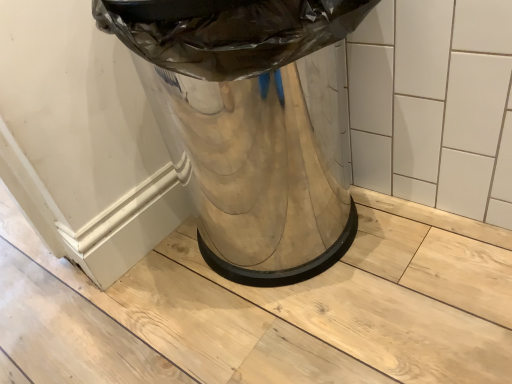
The width and height of the screenshot is (512, 384). What do you see at coordinates (435, 104) in the screenshot?
I see `white glossy tile at upper center` at bounding box center [435, 104].

At what (x,y) coordinates should I click in order to perform the action: click on white glossy tile at upper center. Please return your answer as a coordinate pair (x, y). Image resolution: width=512 pixels, height=384 pixels. Looking at the image, I should click on (435, 104).

Describe the element at coordinates (245, 126) in the screenshot. Image resolution: width=512 pixels, height=384 pixels. I see `shiny metallic trash can at center` at that location.

The image size is (512, 384). In order to click on shiny metallic trash can at center in this screenshot , I will do 245,126.

Image resolution: width=512 pixels, height=384 pixels. What are the coordinates of `white glossy tile at upper center` in the screenshot? It's located at (435, 104).

Does shiny metallic trash can at center appear on the left side of white glossy tile at upper center?

Indeed, shiny metallic trash can at center is positioned on the left side of white glossy tile at upper center.

Considering their positions, is shiny metallic trash can at center located in front of or behind white glossy tile at upper center?

shiny metallic trash can at center is positioned closer to the viewer than white glossy tile at upper center.

Is point (287, 14) positioned behind point (487, 66)?

No.

From the image's perspective, is shiny metallic trash can at center positioned above or below white glossy tile at upper center?

Answer: Based on their image positions, shiny metallic trash can at center is located beneath white glossy tile at upper center.

From a real-world perspective, is shiny metallic trash can at center beneath white glossy tile at upper center?

No, from a real-world perspective, shiny metallic trash can at center is not beneath white glossy tile at upper center.

Between shiny metallic trash can at center and white glossy tile at upper center, which one has larger width?

shiny metallic trash can at center.

Is shiny metallic trash can at center taller than white glossy tile at upper center?

Indeed, shiny metallic trash can at center has a greater height compared to white glossy tile at upper center.

Considering the sizes of shiny metallic trash can at center and white glossy tile at upper center in the image, is shiny metallic trash can at center bigger or smaller than white glossy tile at upper center?

shiny metallic trash can at center is bigger than white glossy tile at upper center.

Would you say white glossy tile at upper center is part of shiny metallic trash can at center's contents?

No, white glossy tile at upper center is located outside of shiny metallic trash can at center.

Are shiny metallic trash can at center and white glossy tile at upper center located far from each other?

shiny metallic trash can at center is near white glossy tile at upper center, not far away.

Does shiny metallic trash can at center turn towards white glossy tile at upper center?

No, shiny metallic trash can at center does not turn towards white glossy tile at upper center.

What's the angular difference between shiny metallic trash can at center and white glossy tile at upper center's facing directions?

89.5 degrees.

How distant is shiny metallic trash can at center from white glossy tile at upper center?

shiny metallic trash can at center and white glossy tile at upper center are 9.89 inches apart.

Find the location of a particular element. The image size is (512, 384). tile located on the right of shiny metallic trash can at center is located at coordinates (435, 104).

Between white glossy tile at upper center and shiny metallic trash can at center, which one appears on the left side from the viewer's perspective?

shiny metallic trash can at center is more to the left.

Is the position of white glossy tile at upper center more distant than that of shiny metallic trash can at center?

Yes, it is behind shiny metallic trash can at center.

Is point (386, 63) positioned in front of point (228, 206)?

Yes, it is in front of point (228, 206).

From the image's perspective, is white glossy tile at upper center over shiny metallic trash can at center?

Yes, from the image's perspective, white glossy tile at upper center is over shiny metallic trash can at center.

From a real-world perspective, is white glossy tile at upper center located beneath shiny metallic trash can at center?

Correct, in the physical world, white glossy tile at upper center is lower than shiny metallic trash can at center.

Considering the sizes of white glossy tile at upper center and shiny metallic trash can at center in the image, is white glossy tile at upper center wider or thinner than shiny metallic trash can at center?

white glossy tile at upper center is thinner than shiny metallic trash can at center.

Does white glossy tile at upper center have a lesser height compared to shiny metallic trash can at center?

Correct, white glossy tile at upper center is not as tall as shiny metallic trash can at center.

Considering the sizes of white glossy tile at upper center and shiny metallic trash can at center in the image, is white glossy tile at upper center bigger or smaller than shiny metallic trash can at center?

Clearly, white glossy tile at upper center is smaller in size than shiny metallic trash can at center.

Choose the correct answer: Is white glossy tile at upper center inside shiny metallic trash can at center or outside it?

white glossy tile at upper center is outside shiny metallic trash can at center.

Is there a large distance between white glossy tile at upper center and shiny metallic trash can at center?

No, white glossy tile at upper center is in close proximity to shiny metallic trash can at center.

From the picture: Could you tell me if white glossy tile at upper center is facing shiny metallic trash can at center?

Yes, white glossy tile at upper center is aimed at shiny metallic trash can at center.

How many degrees apart are the facing directions of white glossy tile at upper center and shiny metallic trash can at center?

89.5 degrees separate the facing orientations of white glossy tile at upper center and shiny metallic trash can at center.

I want to click on waste container above the white glossy tile at upper center (from a real-world perspective), so click(x=245, y=126).

This screenshot has height=384, width=512. Identify the location of tile above the shiny metallic trash can at center (from the image's perspective). (435, 104).

Where is `waste container in front of the white glossy tile at upper center`? Image resolution: width=512 pixels, height=384 pixels. waste container in front of the white glossy tile at upper center is located at coordinates (245, 126).